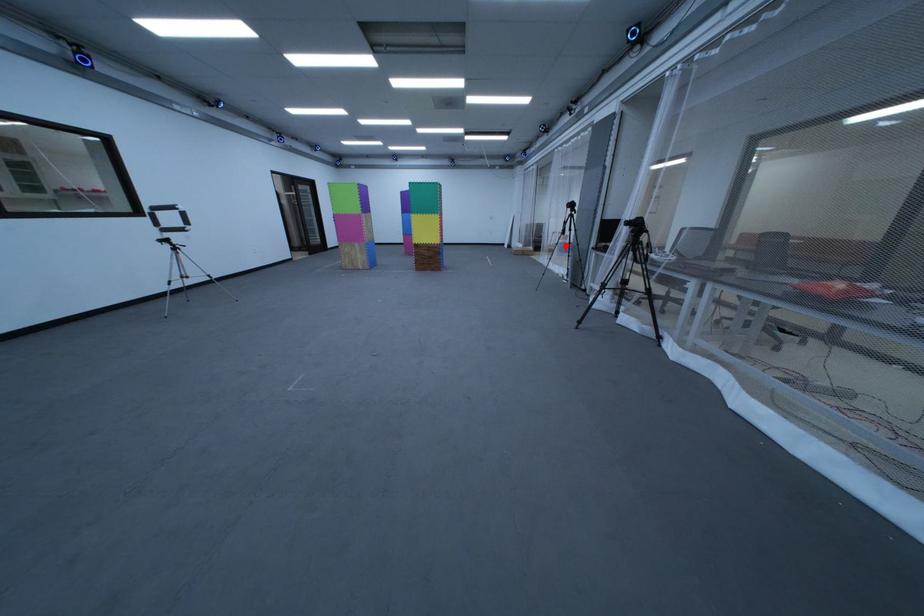
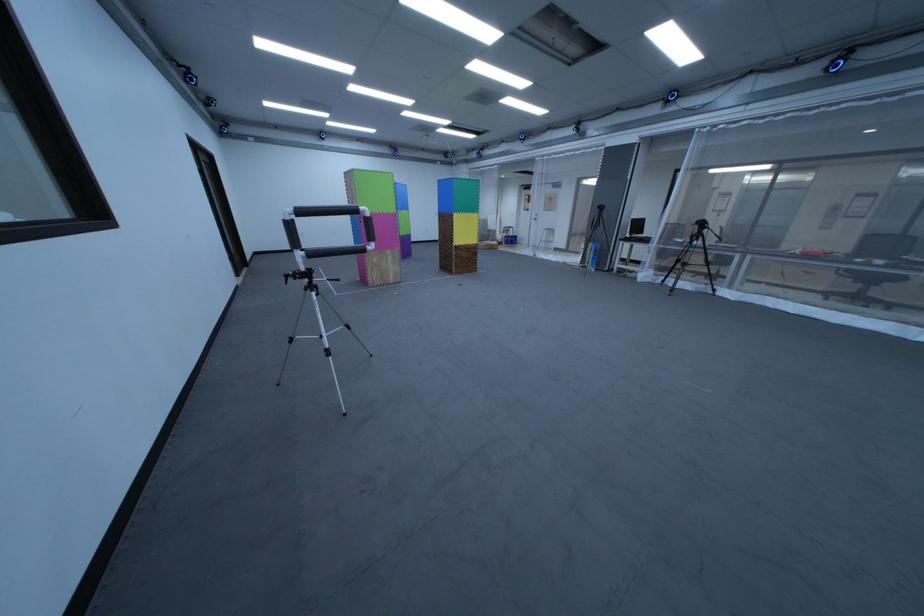
Find the pixel in the second image that matches the highlighted location in the first image.

(517, 238)